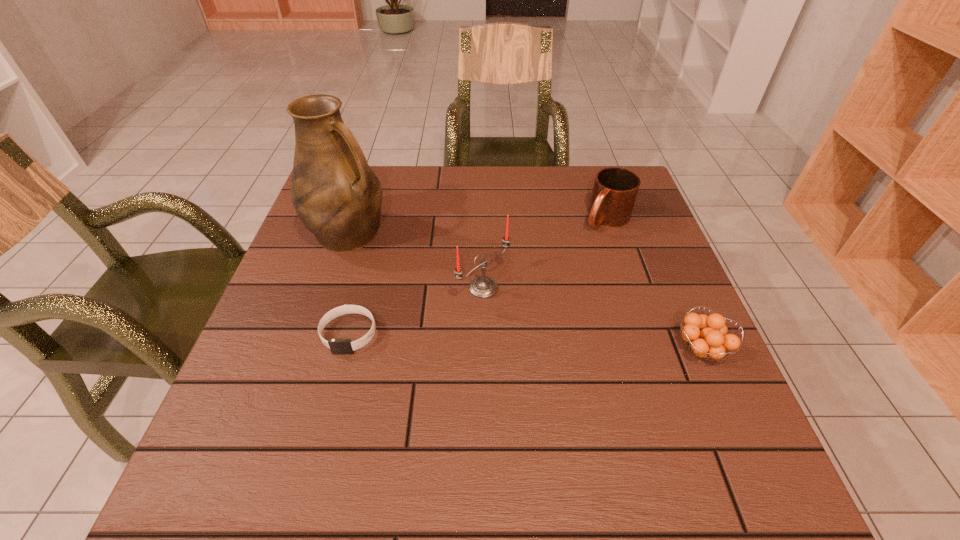
You are a GUI agent. You are given a task and a screenshot of the screen. Output one action in this format:
    pyautogui.click(x=<x>, y=<y>)
    Task: Click on the blank region between the tallest object and the mug
    
    Given the screenshot: What is the action you would take?
    pyautogui.click(x=478, y=226)

This screenshot has height=540, width=960. In order to click on object that is the third closest to the third shortest object in this screenshot , I will do `click(336, 195)`.

Locate an element on the screen. This screenshot has height=540, width=960. the second closest object to the third shortest object is located at coordinates (706, 336).

You are a GUI agent. You are given a task and a screenshot of the screen. Output one action in this format:
    pyautogui.click(x=<x>, y=<y>)
    Task: Click on the vacant space that satisfies the following two spatial constraints: 1. on the outer surface of the wristband; 2. on the right side of the second shortest object
    The height and width of the screenshot is (540, 960).
    Given the screenshot: What is the action you would take?
    pyautogui.click(x=345, y=349)

Where is `free spot that satisfies the following two spatial constraints: 1. on the outer surface of the orange fruit; 2. on the right side of the shortest object`? The width and height of the screenshot is (960, 540). free spot that satisfies the following two spatial constraints: 1. on the outer surface of the orange fruit; 2. on the right side of the shortest object is located at coordinates click(x=345, y=349).

Where is `free space that satisfies the following two spatial constraints: 1. on the outer surface of the wristband; 2. on the right side of the second shortest object`? This screenshot has height=540, width=960. free space that satisfies the following two spatial constraints: 1. on the outer surface of the wristband; 2. on the right side of the second shortest object is located at coordinates (345, 349).